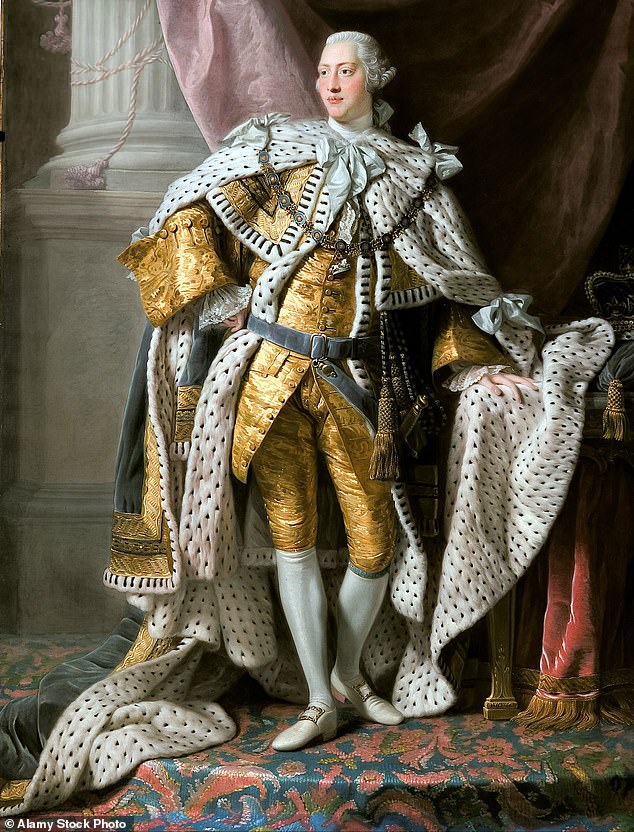
Locate an element on the screen. The image size is (634, 832). leg of table is located at coordinates coord(498,706).